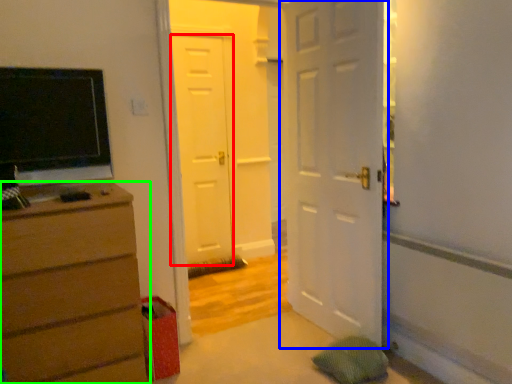
Question: Considering the real-world distances, which object is farthest from door (highlighted by a red box)? door (highlighted by a blue box) or chest of drawers (highlighted by a green box)?

Choices:
 (A) door
 (B) chest of drawers

Answer: (B)